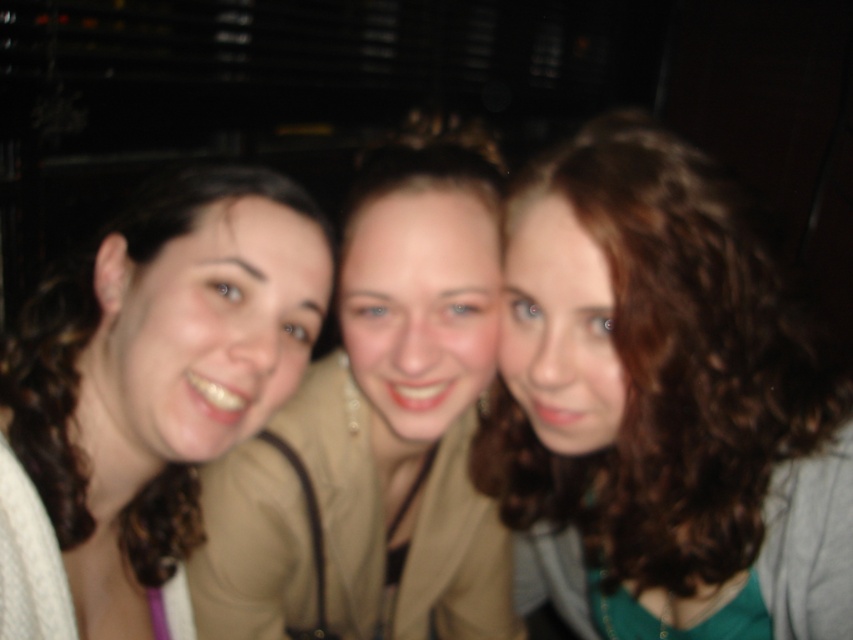
You are a photographer adjusting the camera settings for a group photo. The scene has three people standing close together. The person on the left is wearing a matte beige shirt, and the person in the center has curly brown hair. Since the camera has a limited focus area, you need to ensure that both the matte beige shirt at left and the curly brown hair at center are fully within the frame. Based on their widths, which one requires more space horizontally to fit entirely in the photo?

The curly brown hair at center requires more horizontal space because its width surpasses that of the matte beige shirt at left.

You are trying to locate the curly brown hair at center in a dimly lit photo. The photo has three people standing close together. The left person has shoulder length curly brown hair and a light colored top. The middle person has shoulder length brown hair and a beige jacket over a darker top. The right person has curly reddish brown hair and a green top with a gray cardigan. The coordinates given are point (662, 404). Which person does this point correspond to?

The point (662, 404) corresponds to the curly brown hair at center, which belongs to the middle person who has shoulder length brown hair and is wearing a beige jacket over a darker top.

Based on the scene description, where exactly is the matte beige shirt at left located in terms of coordinates?

The matte beige shirt at left is located at point coordinates of (148, 396).